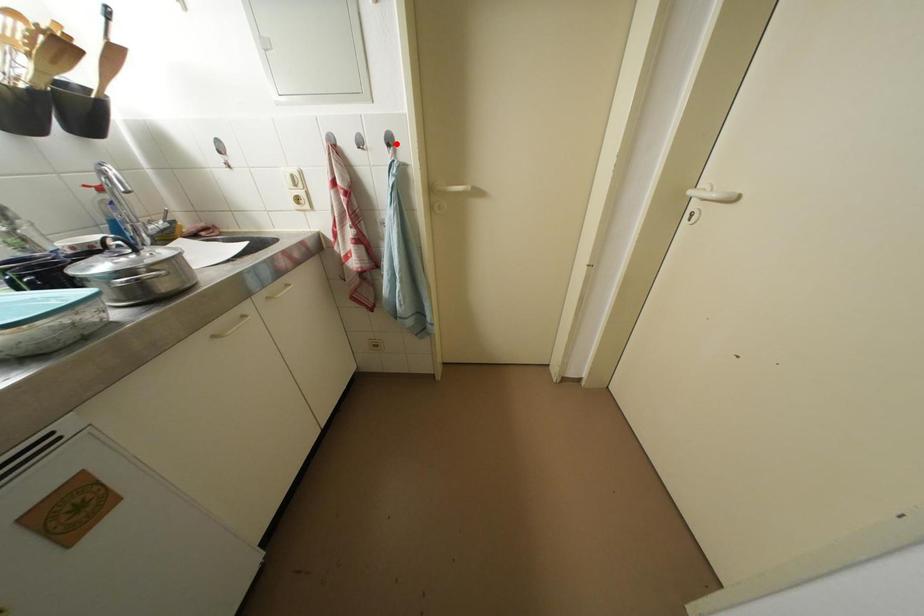
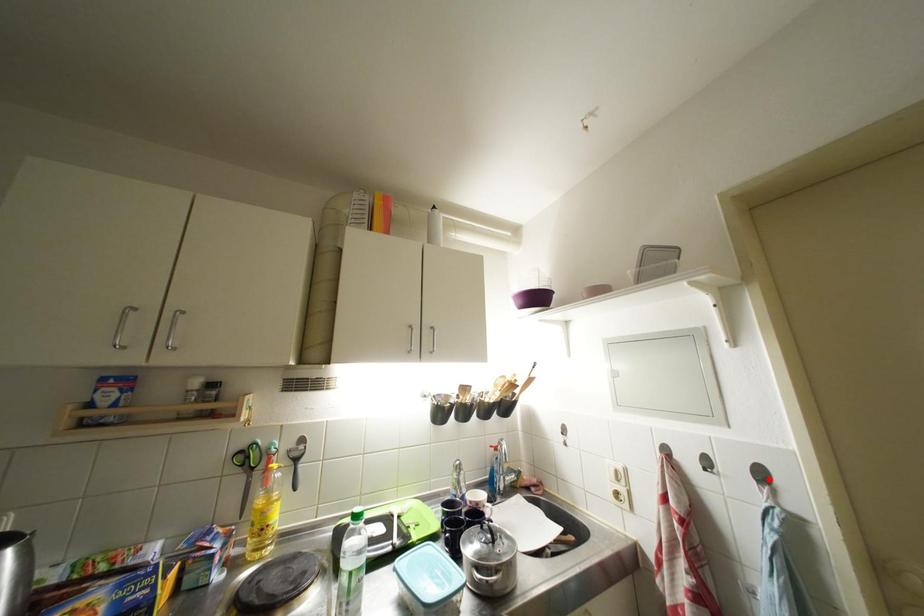
I am providing you with two images of the same scene from different viewpoints. A red point is marked on the first image and another point is marked on the second image. Do the highlighted points in image1 and image2 indicate the same real-world spot?

Yes